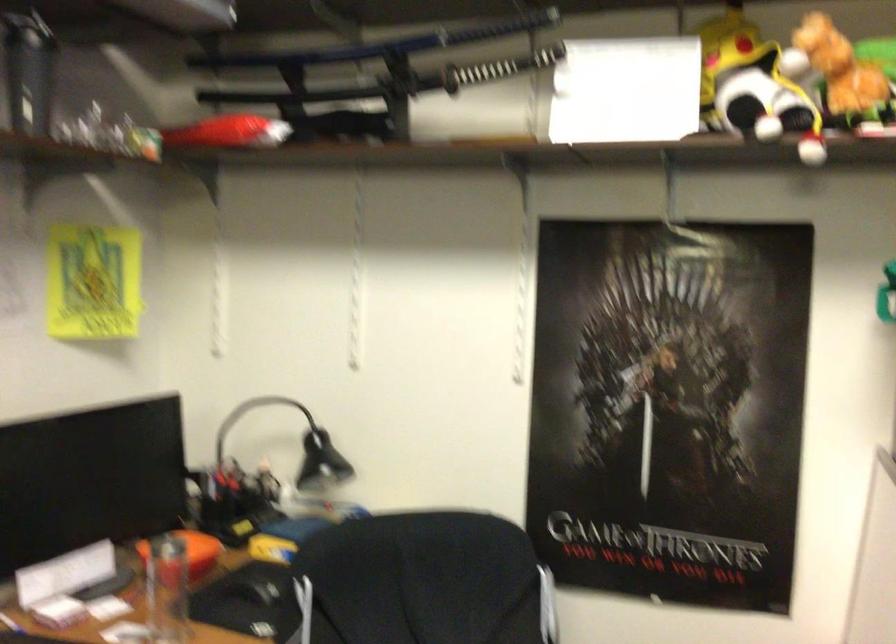
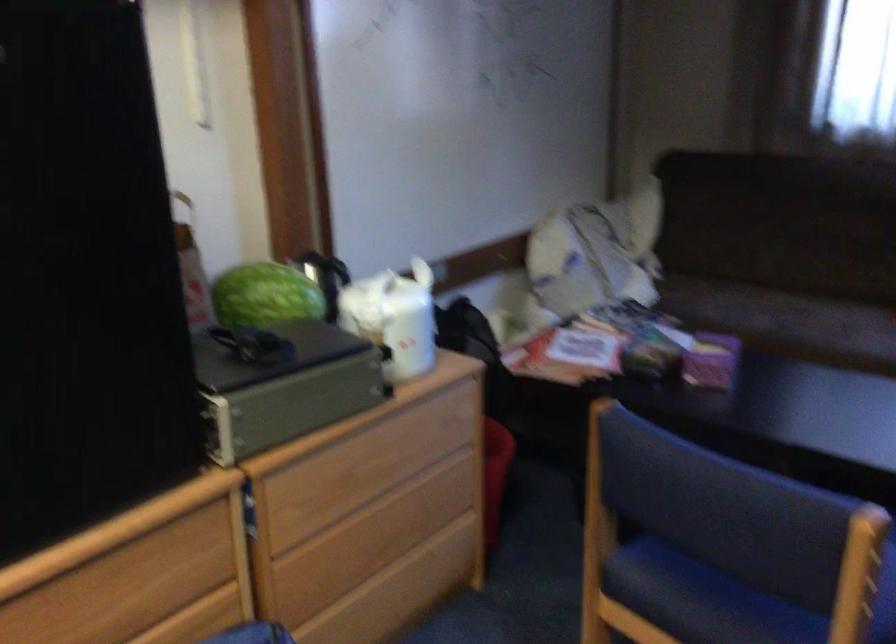
The images are taken continuously from a first-person perspective. In which direction is your viewpoint rotating?

The camera rotated toward right-down.